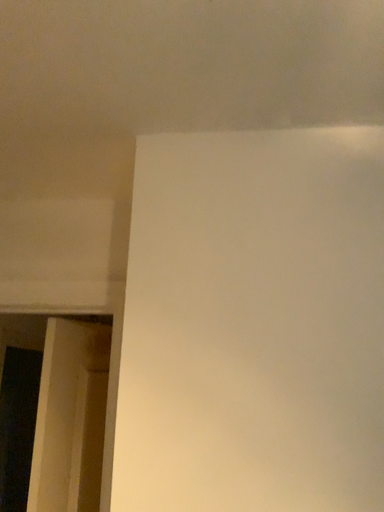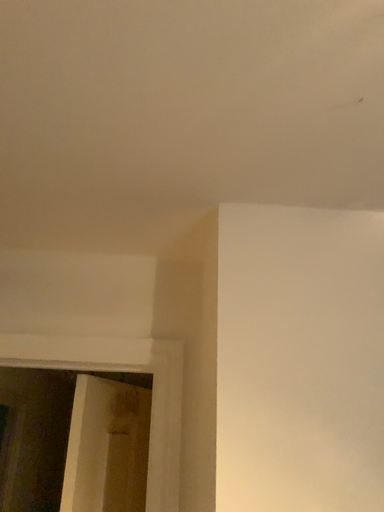
Question: How did the camera likely rotate when shooting the video?

Choices:
 (A) rotated upward
 (B) rotated downward

Answer: (A)